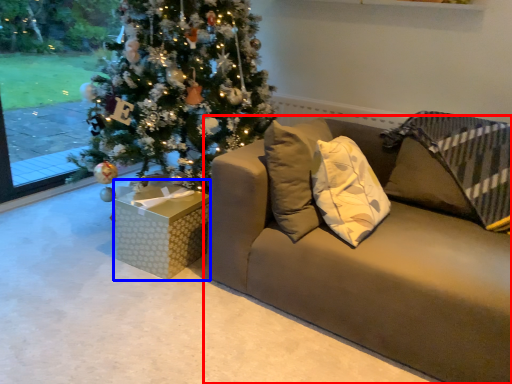
Question: Which of the following is the closest to the observer, studio couch (highlighted by a red box) or furniture (highlighted by a blue box)?

Choices:
 (A) studio couch
 (B) furniture

Answer: (A)